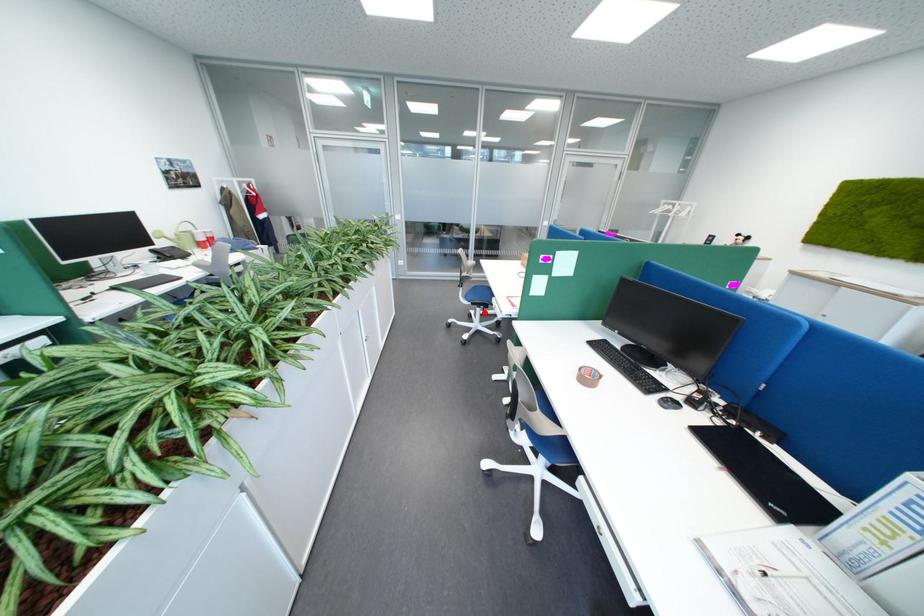
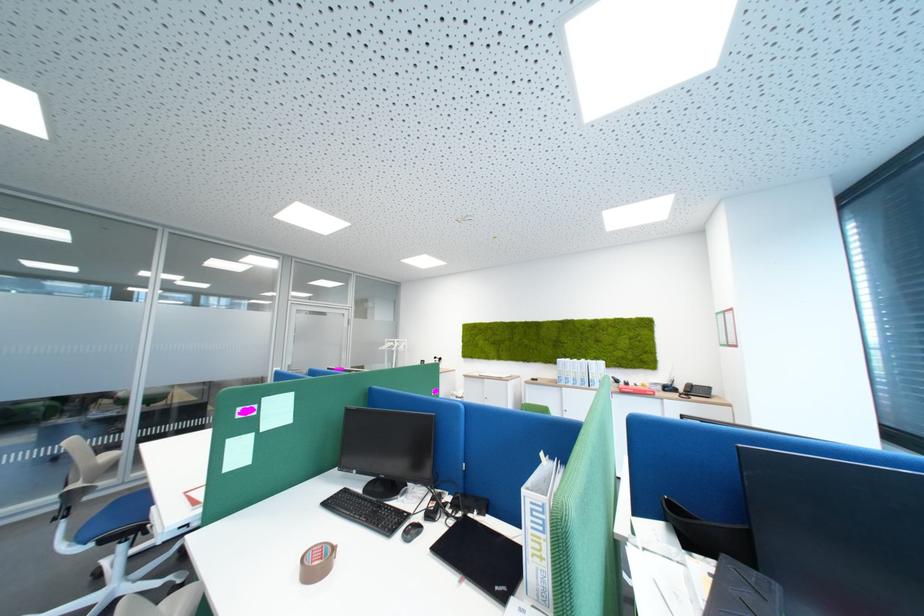
Question: I am providing you with two images of the same scene from different viewpoints. A red point is shown in image1. For the corresponding object point in image2, is it positioned nearer or farther from the camera?

Choices:
 (A) Nearer
 (B) Farther

Answer: (A)